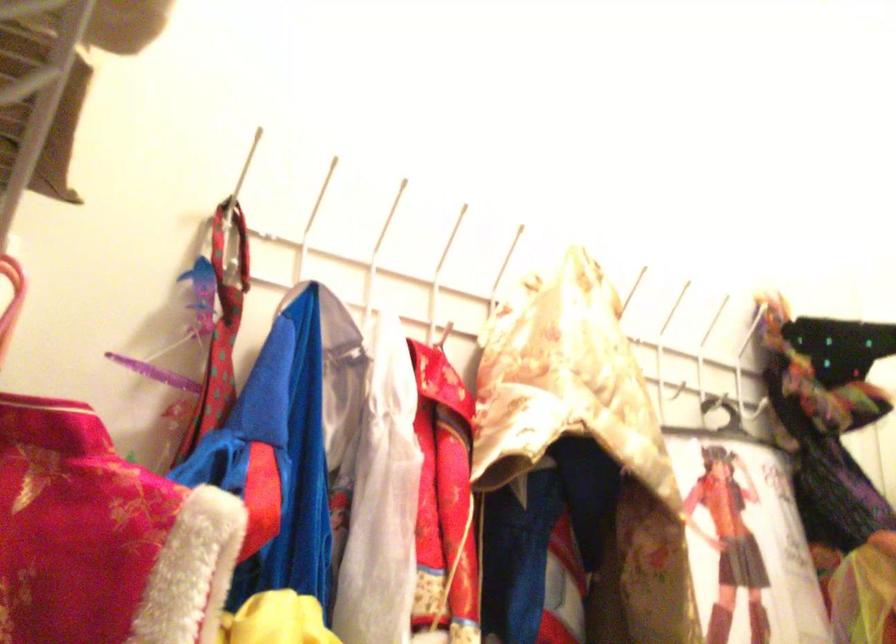
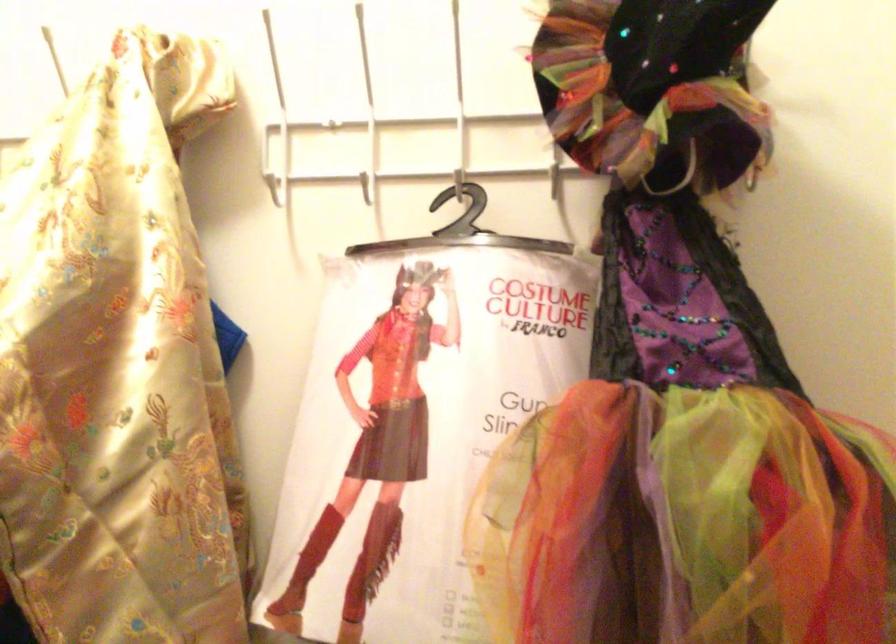
Question: The images are taken continuously from a first-person perspective. In which direction is your viewpoint rotating?

Choices:
 (A) Left
 (B) Right
 (C) Up
 (D) Down

Answer: (A)